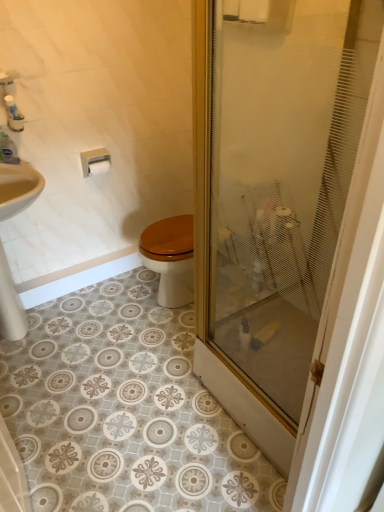
Question: From a real-world perspective, relative to white matte toilet paper at upper left, is white plastic toilet paper holder at upper left vertically above or below?

Choices:
 (A) above
 (B) below

Answer: (A)

Question: In terms of height, does white plastic toilet paper holder at upper left look taller or shorter compared to white matte toilet paper at upper left?

Choices:
 (A) short
 (B) tall

Answer: (B)

Question: Estimate the real-world distances between objects in this image. Which object is farther from the white plastic toilet paper holder at upper left?

Choices:
 (A) transparent frosted glass at center
 (B) white matte toilet paper at upper left
 (C) clear plastic bottle at upper left

Answer: (A)

Question: Based on their relative distances, which object is nearer to the white matte toilet paper at upper left?

Choices:
 (A) clear plastic bottle at upper left
 (B) transparent frosted glass at center
 (C) white plastic toilet paper holder at upper left

Answer: (C)